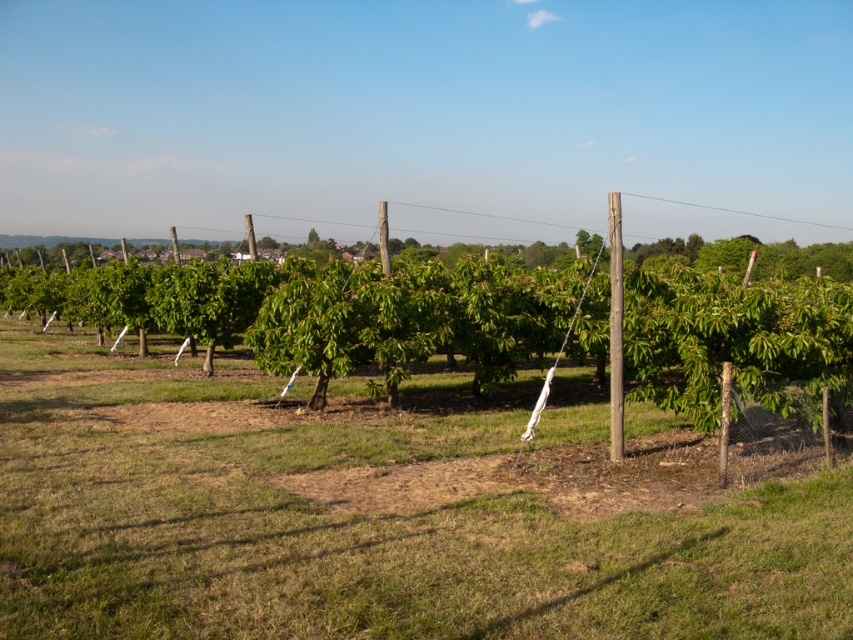
This screenshot has height=640, width=853. Describe the element at coordinates (347, 314) in the screenshot. I see `green leafy tree at center` at that location.

Which is above, green leafy tree at center or smooth wooden pole at center?

green leafy tree at center is higher up.

Find the location of a particular element. This screenshot has width=853, height=640. green leafy tree at center is located at coordinates (347, 314).